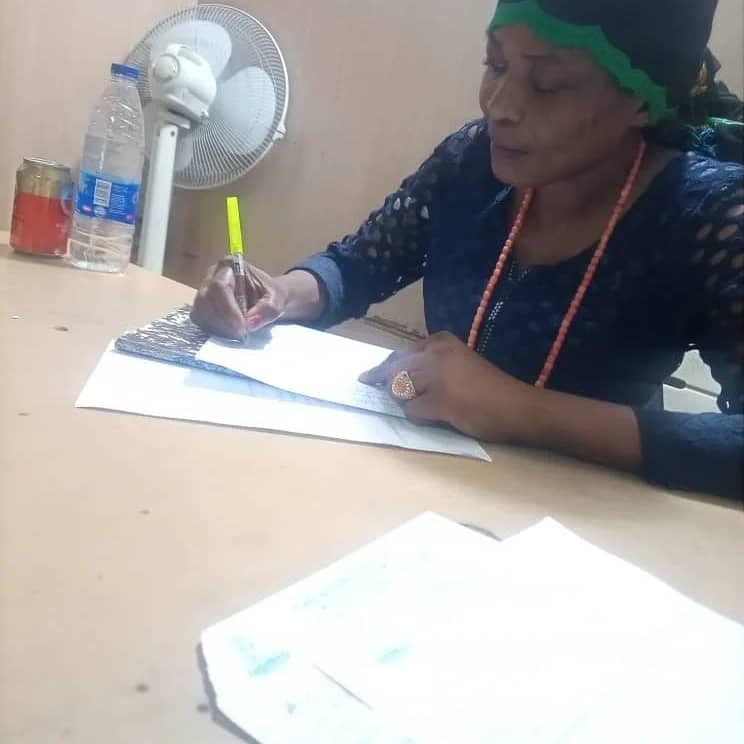
Find the location of `fan`. fan is located at coordinates (227, 129).